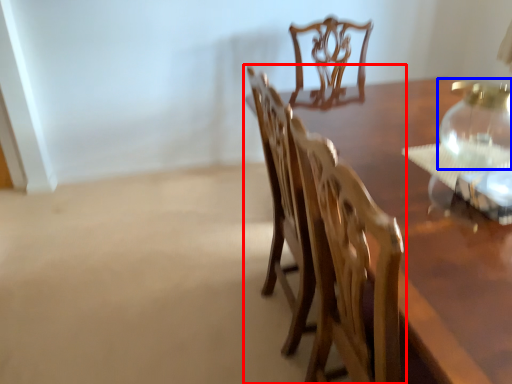
Question: Which point is closer to the camera, chair (highlighted by a red box) or glass vase (highlighted by a blue box)?

Choices:
 (A) chair
 (B) glass vase

Answer: (A)